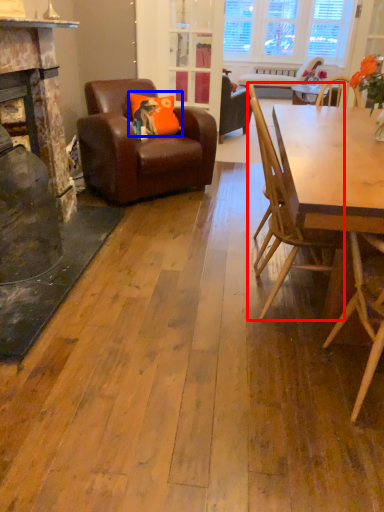
Question: Which object appears farthest to the camera in this image, chair (highlighted by a red box) or pillow (highlighted by a blue box)?

Choices:
 (A) chair
 (B) pillow

Answer: (B)